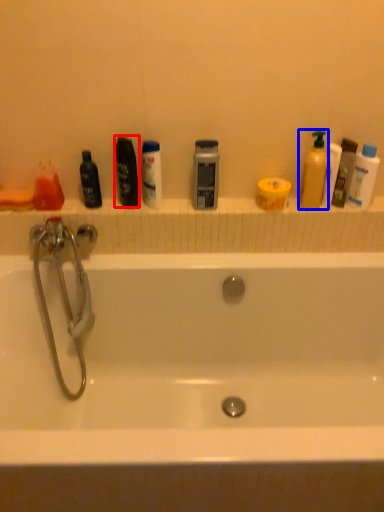
Question: Which object appears farthest to the camera in this image, mouthwash (highlighted by a red box) or cleaning product (highlighted by a blue box)?

Choices:
 (A) mouthwash
 (B) cleaning product

Answer: (A)